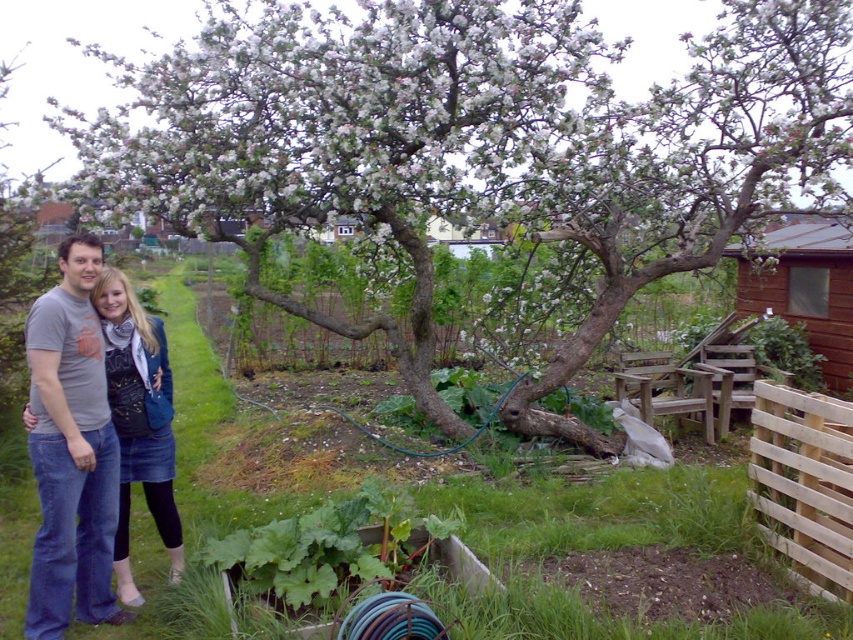
You are standing in the garden and want to take a photo of the smooth bark tree at center. If your camera has a maximum focus range of 5 meters, will you be able to capture the tree clearly without moving closer?

The smooth bark tree at center is 4.79 meters from viewer, which is within the camera maximum focus range of 5 meters. Therefore, you can capture the tree clearly without moving closer.

You are standing in the garden and want to take a photo of the point at coordinates (669, 150). If your camera has a maximum focus range of 6 meters, will it be able to focus on that point?

The distance of point (669, 150) from the camera is 6.61 meters, which exceeds the camera maximum focus range of 6 meters. Therefore, the camera will not be able to focus on that point.